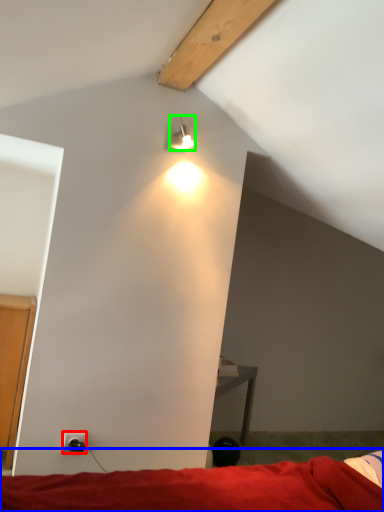
Question: Based on their relative distances, which object is nearer to power outlet (highlighted by a red box)? Choose from bed (highlighted by a blue box) and lamp (highlighted by a green box).

Choices:
 (A) bed
 (B) lamp

Answer: (A)